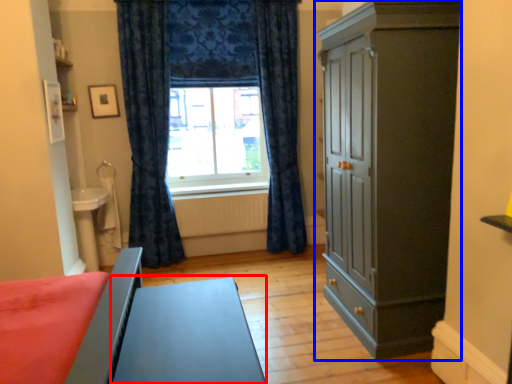
Question: Which of the following is the closest to the observer, table (highlighted by a red box) or cupboard (highlighted by a blue box)?

Choices:
 (A) table
 (B) cupboard

Answer: (A)